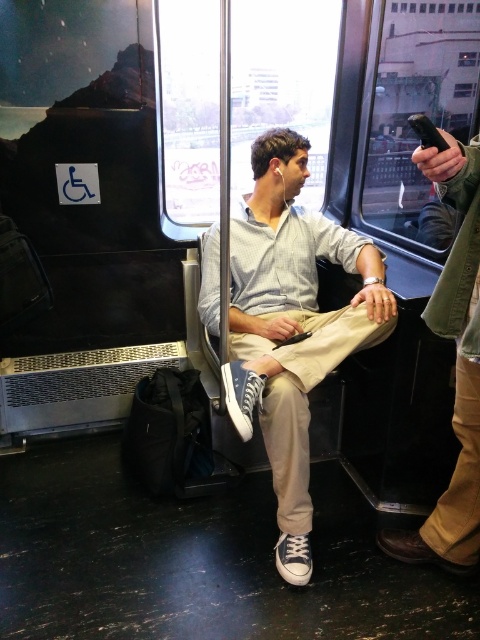
Question: Does light gray cotton shirt at center come in front of brown leather phone at right?

Choices:
 (A) no
 (B) yes

Answer: (A)

Question: Does light gray cotton shirt at center lie behind brown leather phone at right?

Choices:
 (A) yes
 (B) no

Answer: (A)

Question: Which of the following is the farthest from the observer?

Choices:
 (A) light gray cotton shirt at center
 (B) brown leather phone at right

Answer: (A)

Question: Which point is closer to the camera taking this photo?

Choices:
 (A) click(x=267, y=330)
 (B) click(x=443, y=308)

Answer: (B)

Question: Which object is closer to the camera taking this photo?

Choices:
 (A) brown leather phone at right
 (B) light gray cotton shirt at center

Answer: (A)

Question: Does light gray cotton shirt at center appear over brown leather phone at right?

Choices:
 (A) no
 (B) yes

Answer: (B)